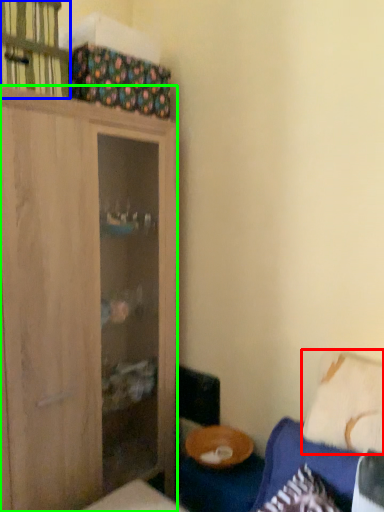
Question: Based on their relative distances, which object is farther from pillow (highlighted by a red box)? Choose from cabinet (highlighted by a blue box) and cabinetry (highlighted by a green box).

Choices:
 (A) cabinet
 (B) cabinetry

Answer: (A)